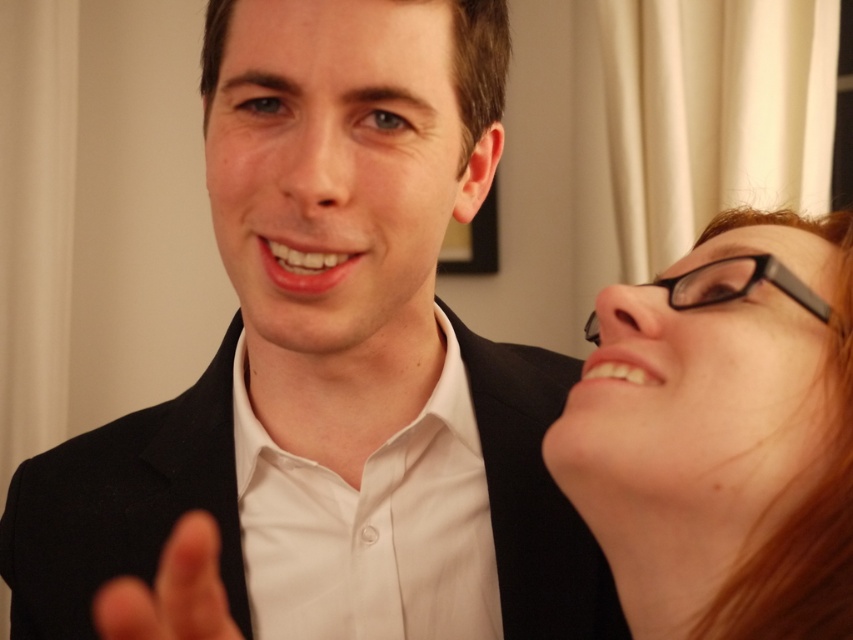
You are a photographer trying to focus on the glasses of the person on the right. Given that the glasses are at point (723,435), where should you adjust your camera to capture them clearly?

The point (723,435) indicates the location of the matte black glasses at upper right, so you should adjust your camera to focus on the upper right area to capture them clearly.